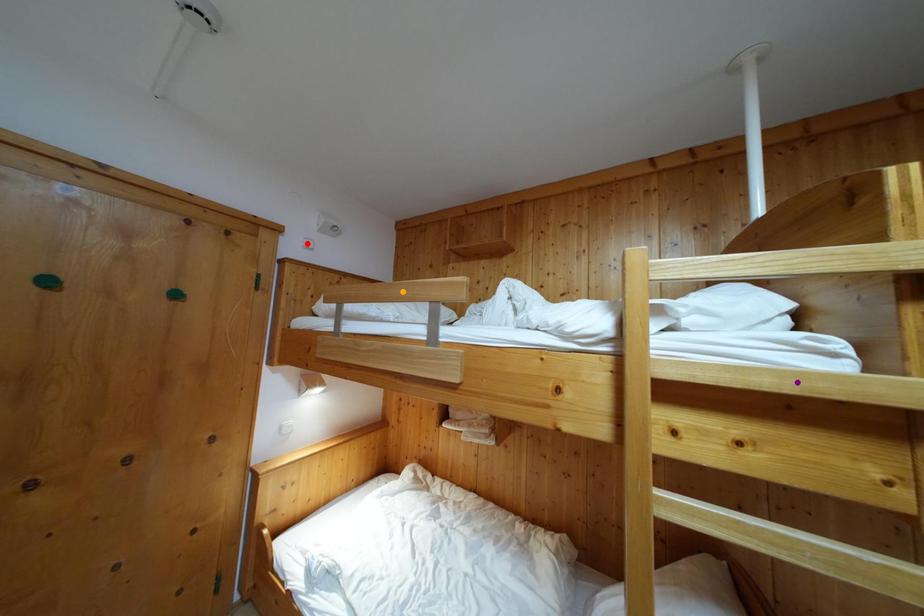
Order these from farthest to nearest:
orange point | purple point | red point

red point
orange point
purple point